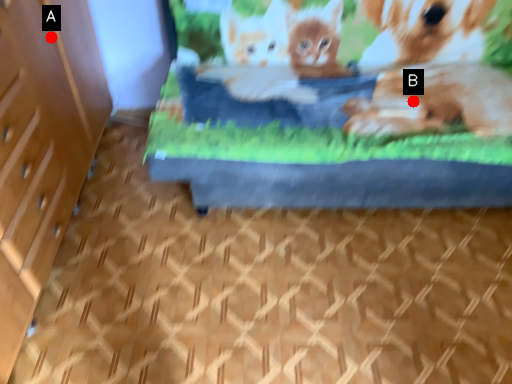
Question: Two points are circled on the image, labeled by A and B beside each circle. Which of the following is the farthest from the observer?

Choices:
 (A) A is further
 (B) B is further

Answer: (B)